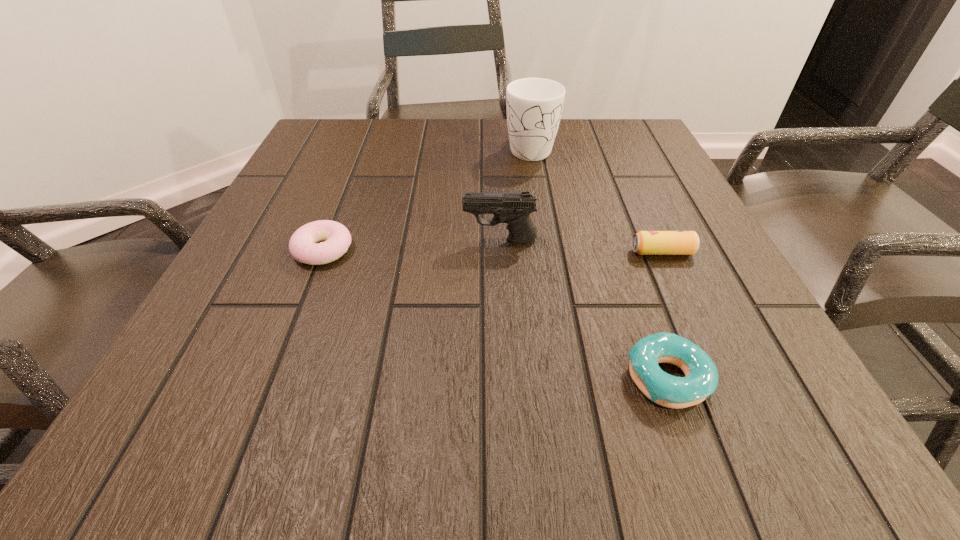
The image size is (960, 540). Find the location of `vacant space located at the barrel of the second tallest object`. vacant space located at the barrel of the second tallest object is located at coordinates (313, 240).

The width and height of the screenshot is (960, 540). Find the location of `free space located 0.360m at the barrel of the second tallest object`. free space located 0.360m at the barrel of the second tallest object is located at coordinates (270, 240).

You are a GUI agent. You are given a task and a screenshot of the screen. Output one action in this format:
    pyautogui.click(x=<x>, y=<y>)
    Task: Click on the vacant point located 0.130m on the back of the beer can
    This screenshot has width=960, height=540.
    Given the screenshot: What is the action you would take?
    [x=640, y=204]

Locate an element on the screen. The image size is (960, 540). vacant point located 0.080m on the right of the nearest object is located at coordinates (767, 378).

This screenshot has width=960, height=540. What are the coordinates of `blank area located 0.320m on the back of the leftmost object` in the screenshot? It's located at (362, 150).

This screenshot has width=960, height=540. Identify the location of object present at the far edge. (534, 106).

Where is `object that is at the near edge`? Image resolution: width=960 pixels, height=540 pixels. object that is at the near edge is located at coordinates [701, 380].

I want to click on object that is at the left edge, so pyautogui.click(x=337, y=239).

Find the location of a particular element. This screenshot has width=960, height=540. beer can that is at the right edge is located at coordinates (644, 242).

Where is `doughnut that is at the right edge`? The width and height of the screenshot is (960, 540). doughnut that is at the right edge is located at coordinates (701, 380).